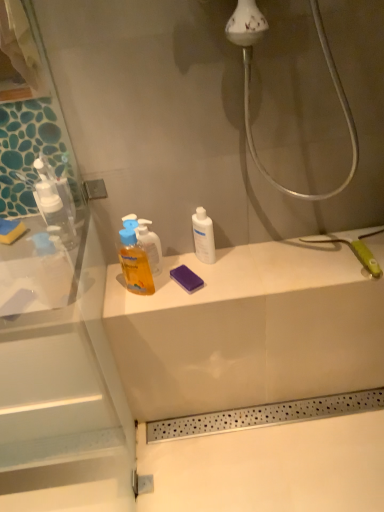
Question: Is translucent plastic bottle at center located within white matte bottle at center?

Choices:
 (A) no
 (B) yes

Answer: (A)

Question: Can you confirm if white matte bottle at center is shorter than translucent plastic bottle at center?

Choices:
 (A) yes
 (B) no

Answer: (A)

Question: Is white matte bottle at center taller than translucent plastic bottle at center?

Choices:
 (A) no
 (B) yes

Answer: (A)

Question: Does white matte bottle at center lie in front of translucent plastic bottle at center?

Choices:
 (A) yes
 (B) no

Answer: (B)

Question: Is white matte bottle at center positioned far away from translucent plastic bottle at center?

Choices:
 (A) no
 (B) yes

Answer: (A)

Question: Is white matte bottle at center smaller than translucent plastic bottle at center?

Choices:
 (A) yes
 (B) no

Answer: (A)

Question: Is translucent plastic bottle at center not near white matte bottle at center?

Choices:
 (A) yes
 (B) no

Answer: (B)

Question: From the image's perspective, is translucent plastic bottle at center under white matte bottle at center?

Choices:
 (A) no
 (B) yes

Answer: (B)

Question: From the image's perspective, is translucent plastic bottle at center on white matte bottle at center?

Choices:
 (A) yes
 (B) no

Answer: (B)

Question: Considering the relative sizes of translucent plastic bottle at center and white matte bottle at center in the image provided, is translucent plastic bottle at center wider than white matte bottle at center?

Choices:
 (A) yes
 (B) no

Answer: (A)

Question: Is translucent plastic bottle at center turned away from white matte bottle at center?

Choices:
 (A) no
 (B) yes

Answer: (A)

Question: Can you confirm if translucent plastic bottle at center is thinner than white matte bottle at center?

Choices:
 (A) yes
 (B) no

Answer: (B)

Question: Considering the relative positions of translucent plastic bottle at center and white matte bottle at center in the image provided, is translucent plastic bottle at center to the left or to the right of white matte bottle at center?

Choices:
 (A) right
 (B) left

Answer: (B)